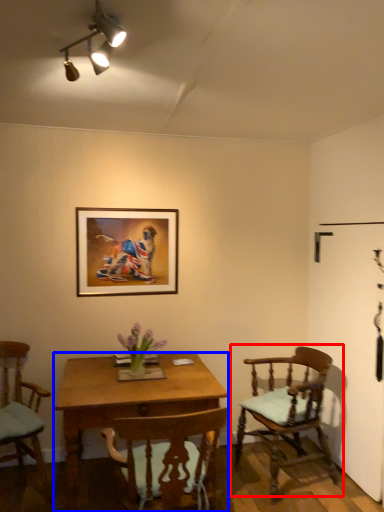
Question: Which point is further to the camera, chair (highlighted by a red box) or desk (highlighted by a blue box)?

Choices:
 (A) chair
 (B) desk

Answer: (A)